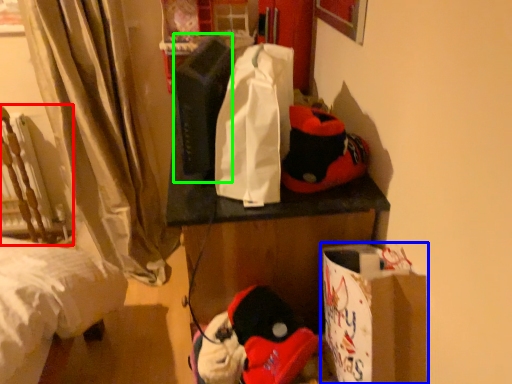
Question: Which object is the closest to the armchair (highlighted by a red box)? Choose among these: cardboard box (highlighted by a blue box) or twin (highlighted by a green box).

Choices:
 (A) cardboard box
 (B) twin

Answer: (B)